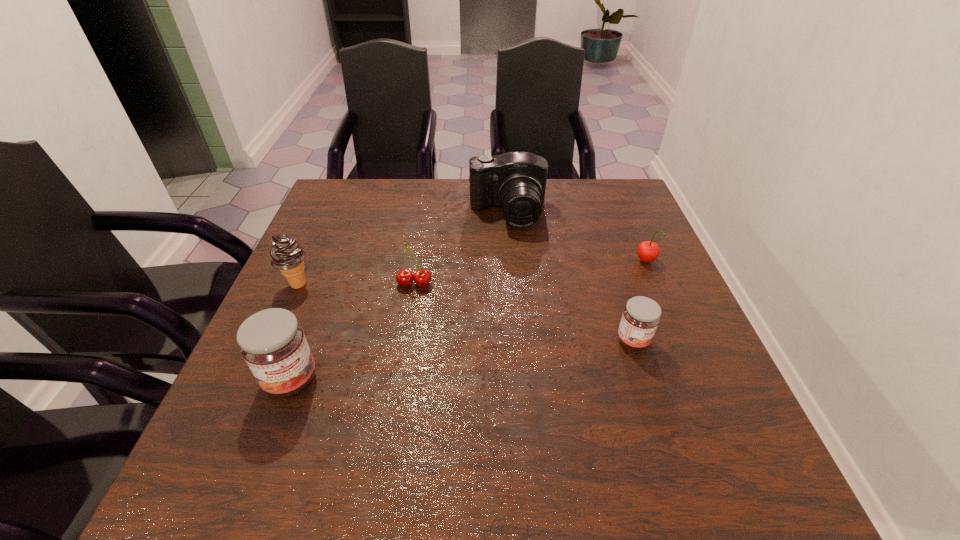
Locate an element on the screen. The width and height of the screenshot is (960, 540). icecream that is at the left edge is located at coordinates (286, 254).

Locate an element on the screen. This screenshot has width=960, height=540. jam that is at the right edge is located at coordinates (641, 316).

The height and width of the screenshot is (540, 960). I want to click on cherry present at the right edge, so click(648, 251).

The width and height of the screenshot is (960, 540). I want to click on object that is at the near left corner, so click(x=272, y=342).

You are a GUI agent. You are given a task and a screenshot of the screen. Output one action in this format:
    pyautogui.click(x=<x>, y=<y>)
    Task: Click on the free region at the far edge of the desktop
    
    Given the screenshot: What is the action you would take?
    pyautogui.click(x=387, y=214)

Identify the location of vacant region at the near edge of the desktop. This screenshot has height=540, width=960. (526, 403).

You are a GUI agent. You are given a task and a screenshot of the screen. Output one action in this format:
    pyautogui.click(x=<x>, y=<y>)
    Task: Click on the free region at the right edge of the desktop
    The image size is (960, 540).
    Given the screenshot: What is the action you would take?
    pyautogui.click(x=672, y=288)

Locate an element on the screen. Image resolution: width=960 pixels, height=540 pixels. vacant area at the far left corner of the desktop is located at coordinates (358, 185).

Where is `free space at the far right corner of the desktop`? This screenshot has width=960, height=540. free space at the far right corner of the desktop is located at coordinates (633, 201).

The width and height of the screenshot is (960, 540). I want to click on blank space at the near right corner of the desktop, so click(655, 422).